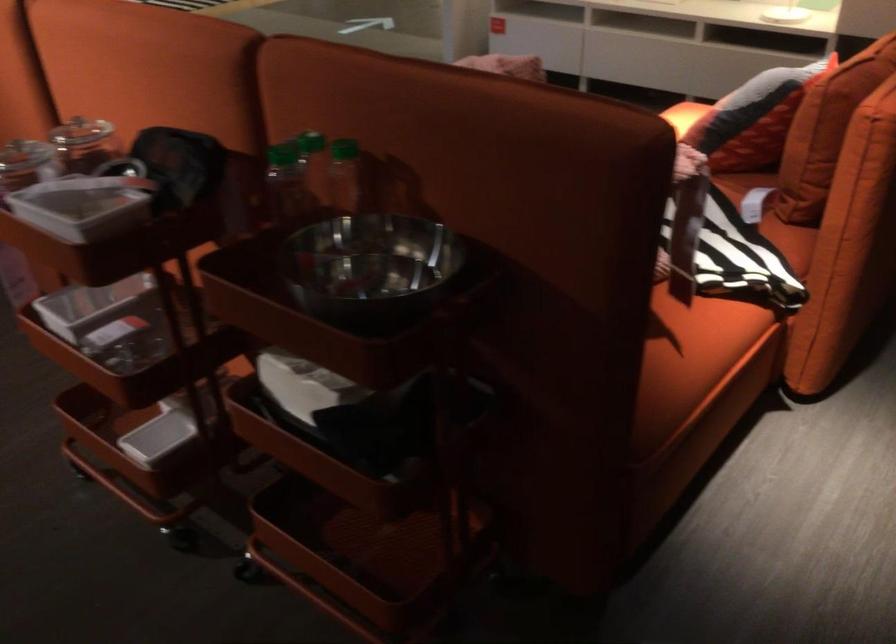
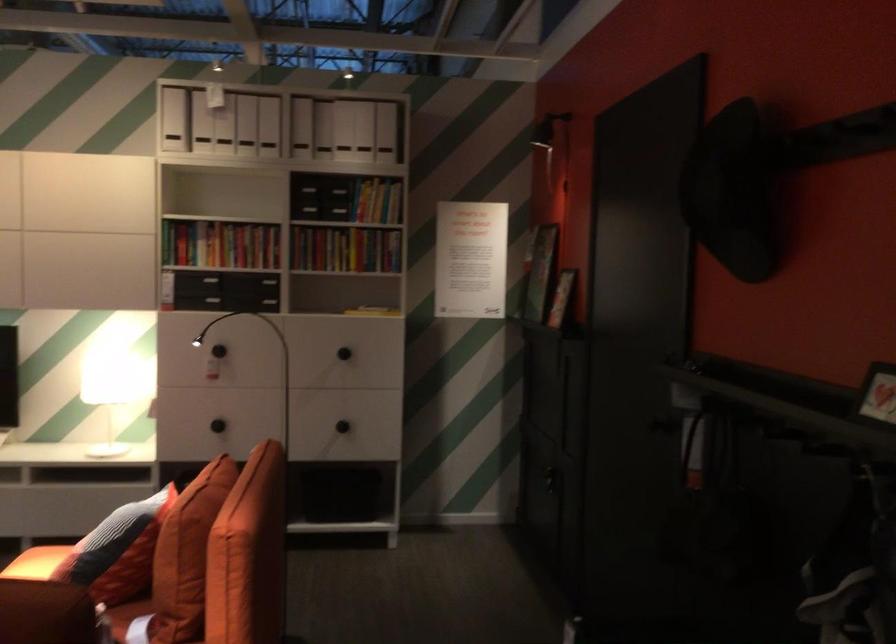
Find the pixel in the second image that matches (x=688, y=111) in the first image.

(36, 563)